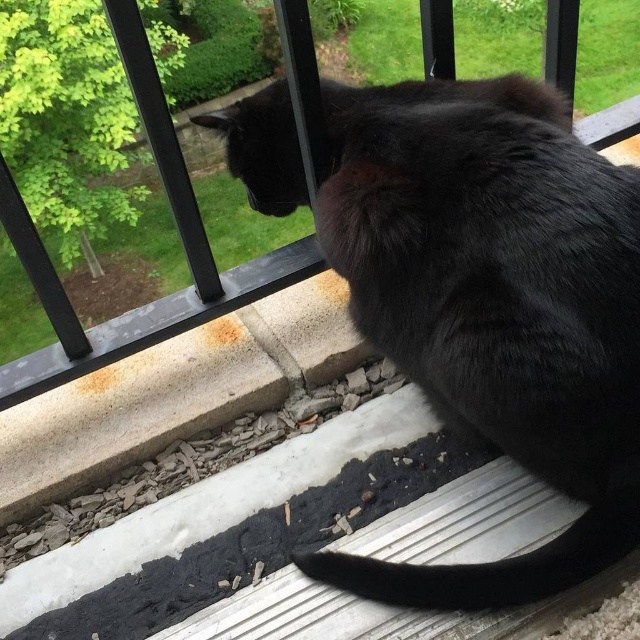
This screenshot has width=640, height=640. Describe the element at coordinates (492, 307) in the screenshot. I see `black fluffy cat at upper center` at that location.

In the scene shown: Can you confirm if black fluffy cat at upper center is positioned to the right of transparent plastic screen door at upper center?

Correct, you'll find black fluffy cat at upper center to the right of transparent plastic screen door at upper center.

I want to click on black fluffy cat at upper center, so click(492, 307).